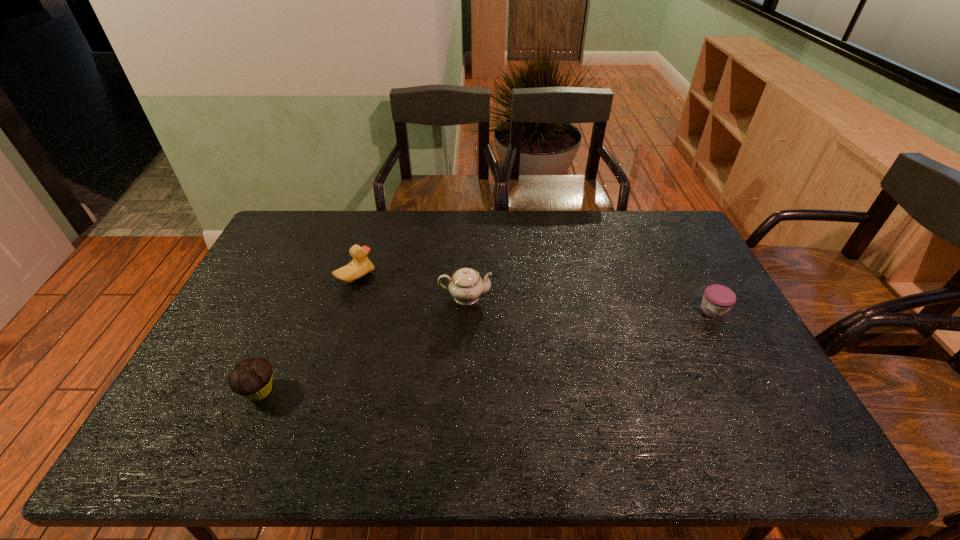
What are the coordinates of `vacant region between the nearest object and the rightmost object` in the screenshot? It's located at (486, 351).

Where is `unoccupied area between the muffin and the rightmost object`? The width and height of the screenshot is (960, 540). unoccupied area between the muffin and the rightmost object is located at coordinates (486, 351).

You are a GUI agent. You are given a task and a screenshot of the screen. Output one action in this format:
    pyautogui.click(x=<x>, y=<y>)
    Task: Click on the free space between the jam and the chinaware
    Image resolution: width=960 pixels, height=540 pixels.
    Given the screenshot: What is the action you would take?
    pyautogui.click(x=589, y=303)

Find the location of a particular element. The width and height of the screenshot is (960, 540). free area in between the leftmost object and the duck is located at coordinates (307, 334).

Image resolution: width=960 pixels, height=540 pixels. Find the location of `free space between the shortest object and the duck`. free space between the shortest object and the duck is located at coordinates [x=535, y=294].

The image size is (960, 540). Identify the location of free area in between the chinaware and the duck. (411, 287).

Locate an element on the screen. The height and width of the screenshot is (540, 960). free spot between the duck and the third object from left to right is located at coordinates (411, 287).

Locate an element on the screen. This screenshot has width=960, height=540. vacant space that's between the leftmost object and the chinaware is located at coordinates (362, 344).

The height and width of the screenshot is (540, 960). I want to click on the third closest object relative to the second object from left to right, so click(x=718, y=299).

Where is `object identified as the second closest to the leftmost object`? This screenshot has height=540, width=960. object identified as the second closest to the leftmost object is located at coordinates (465, 285).